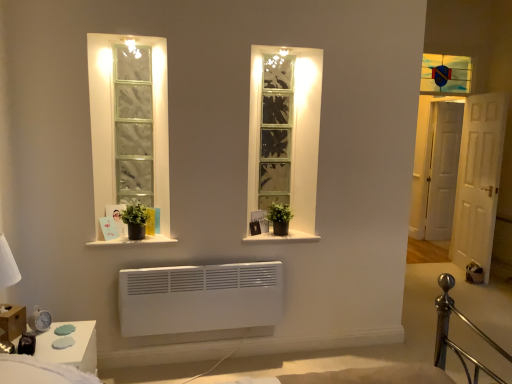
Question: From a real-world perspective, is stained glass window at upper right physically located above or below white wooden door at right, which appears as the first door when viewed from the front?

Choices:
 (A) above
 (B) below

Answer: (A)

Question: Would you say stained glass window at upper right is to the left or to the right of white wooden door at right, which is the 2th door in back-to-front order, in the picture?

Choices:
 (A) left
 (B) right

Answer: (A)

Question: Estimate the real-world distances between objects in this image. Which object is farther from the clear glass window at center?

Choices:
 (A) stained glass window at upper right
 (B) white glossy side table at lower left
 (C) white matte door at right, the second door positioned from the front
 (D) white glossy window sill at center, acting as the 2th window sill starting from the left
 (E) white matte window sill at center, placed as the 2th window sill when sorted from right to left

Answer: (C)

Question: Considering the real-world distances, which object is closest to the white glossy window sill at center, which appears as the 1th window sill when viewed from the right?

Choices:
 (A) white matte door at right, the 1th door when ordered from right to left
 (B) matte brown wooden box at lower left
 (C) stained glass window at upper right
 (D) clear glass window at center
 (E) white matte window sill at center, which is the first window sill in left-to-right order

Answer: (D)